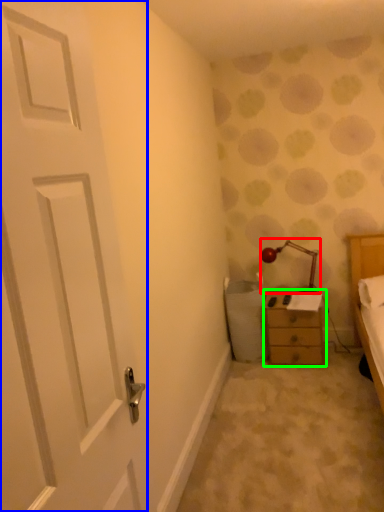
Question: Which object is positioned closest to lamp (highlighted by a red box)? Select from door (highlighted by a blue box) and chest of drawers (highlighted by a green box).

Choices:
 (A) door
 (B) chest of drawers

Answer: (B)